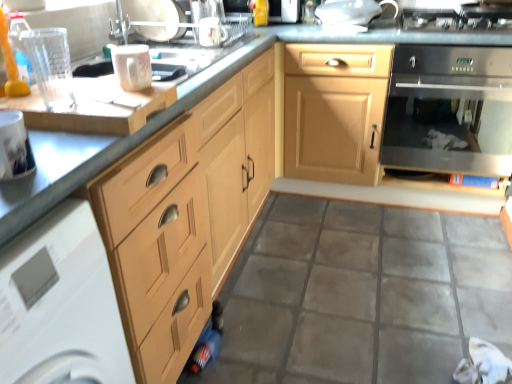
Question: Considering the relative positions of white glossy toaster at upper center, which ranks as the first appliance in right-to-left order, and clear glass tumbler at upper left, acting as the sixth appliance starting from the right, in the image provided, is white glossy toaster at upper center, which ranks as the first appliance in right-to-left order, behind clear glass tumbler at upper left, acting as the sixth appliance starting from the right,?

Choices:
 (A) no
 (B) yes

Answer: (B)

Question: Is white glossy toaster at upper center, positioned as the 6th appliance in front-to-back order, smaller than clear glass tumbler at upper left, acting as the 6th appliance starting from the back?

Choices:
 (A) no
 (B) yes

Answer: (A)

Question: Can you confirm if white glossy toaster at upper center, positioned as the 6th appliance in front-to-back order, is wider than clear glass tumbler at upper left, acting as the 6th appliance starting from the back?

Choices:
 (A) no
 (B) yes

Answer: (B)

Question: Can you confirm if white glossy toaster at upper center, which ranks as the first appliance in right-to-left order, is taller than clear glass tumbler at upper left, acting as the 6th appliance starting from the back?

Choices:
 (A) no
 (B) yes

Answer: (A)

Question: Can you confirm if white glossy toaster at upper center, which ranks as the first appliance in right-to-left order, is shorter than clear glass tumbler at upper left, marked as the first appliance in a front-to-back arrangement?

Choices:
 (A) yes
 (B) no

Answer: (A)

Question: Is the depth of white glossy toaster at upper center, placed as the first appliance when sorted from back to front, less than that of clear glass tumbler at upper left, acting as the sixth appliance starting from the right?

Choices:
 (A) yes
 (B) no

Answer: (B)

Question: Would you consider white glossy toaster at upper center, which ranks as the first appliance in right-to-left order, to be distant from metallic silver sink at upper center, positioned as the 4th appliance in left-to-right order?

Choices:
 (A) no
 (B) yes

Answer: (A)

Question: From a real-world perspective, does white glossy toaster at upper center, marked as the 6th appliance in a left-to-right arrangement, stand above metallic silver sink at upper center, the second appliance positioned from the back?

Choices:
 (A) no
 (B) yes

Answer: (A)

Question: From the image's perspective, is white glossy toaster at upper center, which ranks as the first appliance in right-to-left order, located above metallic silver sink at upper center, positioned as the 4th appliance in left-to-right order?

Choices:
 (A) no
 (B) yes

Answer: (B)

Question: Does white glossy toaster at upper center, positioned as the 6th appliance in front-to-back order, come behind metallic silver sink at upper center, acting as the 3th appliance starting from the right?

Choices:
 (A) yes
 (B) no

Answer: (A)

Question: Is metallic silver sink at upper center, positioned as the 4th appliance in left-to-right order, inside white glossy toaster at upper center, placed as the first appliance when sorted from back to front?

Choices:
 (A) yes
 (B) no

Answer: (B)

Question: From a real-world perspective, is white glossy toaster at upper center, positioned as the 6th appliance in front-to-back order, beneath metallic silver sink at upper center, the second appliance positioned from the back?

Choices:
 (A) no
 (B) yes

Answer: (B)

Question: Considering the relative sizes of matte wood cabinet at center and porcelain glossy mug at upper center, which is counted as the third appliance, starting from the left, in the image provided, is matte wood cabinet at center shorter than porcelain glossy mug at upper center, which is counted as the third appliance, starting from the left,?

Choices:
 (A) no
 (B) yes

Answer: (A)